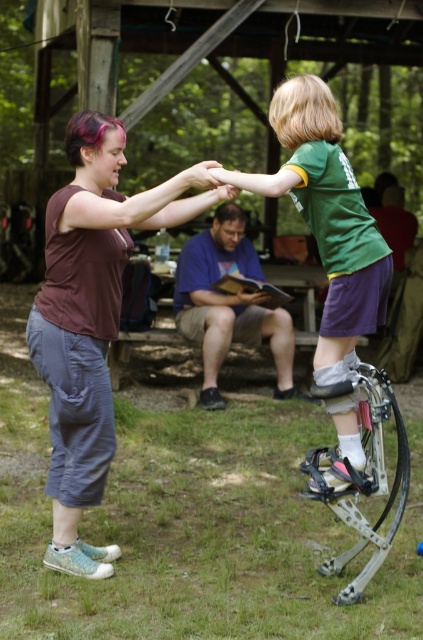
Question: Does green fabric shirt at upper center appear under purple cotton shirt at center?

Choices:
 (A) no
 (B) yes

Answer: (A)

Question: Which point is closer to the camera?

Choices:
 (A) (73, 460)
 (B) (189, 310)
 (C) (323, 339)

Answer: (C)

Question: Does green fabric shirt at upper center appear under purple cotton shirt at center?

Choices:
 (A) yes
 (B) no

Answer: (B)

Question: Based on their relative distances, which object is farther from the matte brown tank top at center?

Choices:
 (A) purple cotton shirt at center
 (B) green fabric shirt at upper center

Answer: (A)

Question: Can you confirm if matte brown tank top at center is positioned to the left of purple cotton shirt at center?

Choices:
 (A) no
 (B) yes

Answer: (B)

Question: Which of the following is the closest to the observer?

Choices:
 (A) (52, 465)
 (B) (304, 128)

Answer: (B)